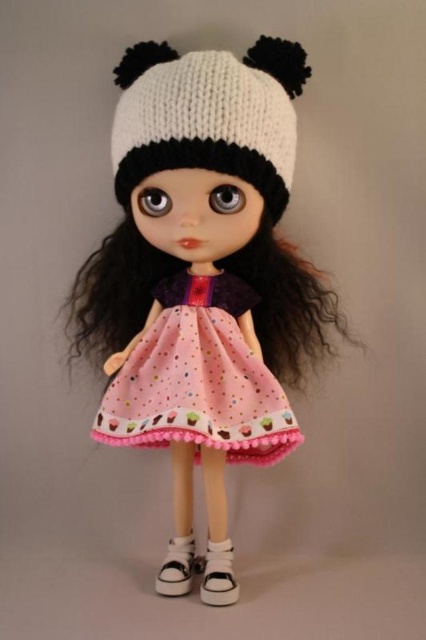
You are observing the doll and want to place a sticker on the point closer to you. Which point should you choose between point (189, 76) and point (164, 310)?

Point (189, 76) is closer to the viewer than point (164, 310), so you should choose point (189, 76) to place the sticker.

You are a photographer taking a picture of the doll. You notice two points on the doll, one at point (x=207, y=364) and the other at point (x=216, y=561). Which point is closer to your camera?

Point (x=207, y=364) is further to the camera than point (x=216, y=561), so the point closer to the camera is point (x=216, y=561).